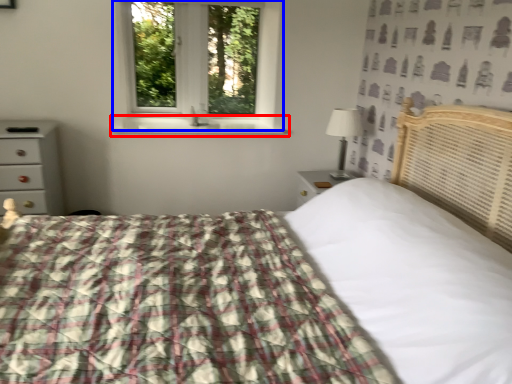
Question: Which point is further to the camera, window sill (highlighted by a red box) or window (highlighted by a blue box)?

Choices:
 (A) window sill
 (B) window

Answer: (B)